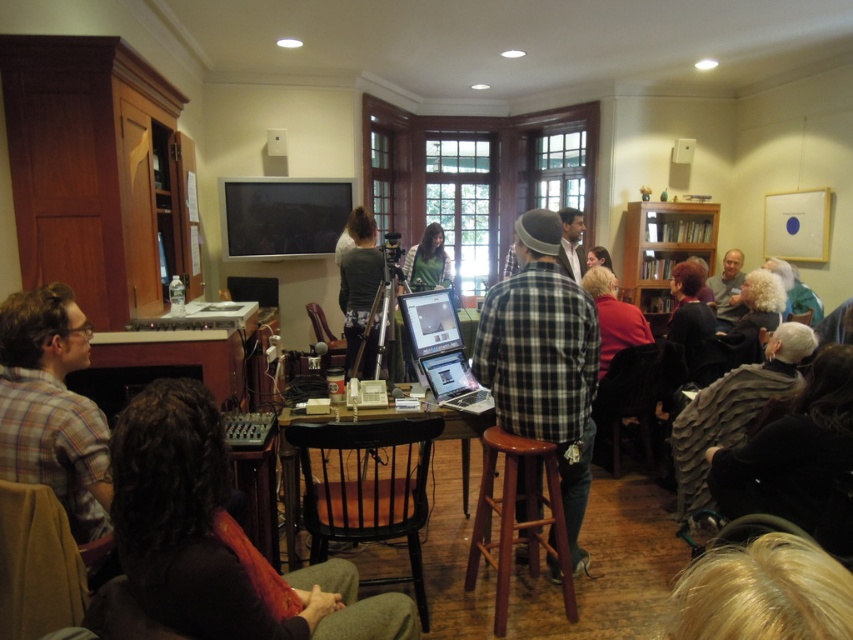
Question: Considering the real-world distances, which object is farthest from the green matte shirt at center?

Choices:
 (A) mahogany wood bar stool at center
 (B) plaid fabric shirt at left
 (C) silver metallic laptop at center
 (D) dark brown leather guitar at lower left

Answer: (D)

Question: Which object is positioned farthest from the dark gray textured sweater at lower right?

Choices:
 (A) plaid fabric shirt at left
 (B) matte gray shirt at center

Answer: (B)

Question: From the image, what is the correct spatial relationship of mahogany wood bar stool at center in relation to matte gray shirt at center?

Choices:
 (A) right
 (B) left

Answer: (A)

Question: Does dark brown leather guitar at lower left come in front of dark gray textured sweater at lower right?

Choices:
 (A) no
 (B) yes

Answer: (B)

Question: Among these objects, which one is farthest from the camera?

Choices:
 (A) woodenmaterial/texturetable at center
 (B) silver metallic laptop at center

Answer: (B)

Question: Is dark gray textured sweater at lower right bigger than green matte shirt at center?

Choices:
 (A) yes
 (B) no

Answer: (A)